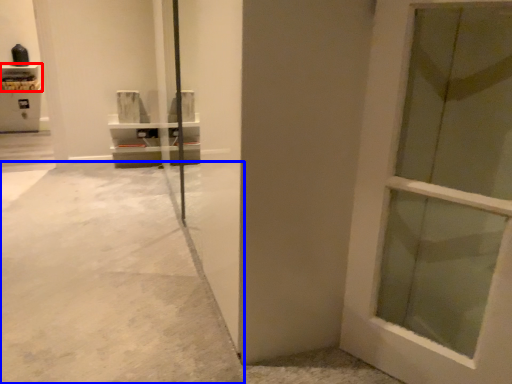
Question: Which object is further to the camera taking this photo, shelf (highlighted by a red box) or concrete (highlighted by a blue box)?

Choices:
 (A) shelf
 (B) concrete

Answer: (A)